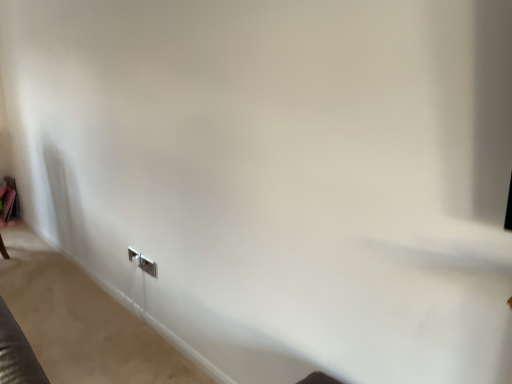
Question: Should I look upward or downward to see white plastic electric outlet at lower left, placed as the second electric outlet when sorted from front to back?

Choices:
 (A) up
 (B) down

Answer: (B)

Question: From a real-world perspective, is white plastic electric outlet at lower center, positioned as the 2th electric outlet in back-to-front order, under white plastic electric outlet at lower left, placed as the second electric outlet when sorted from front to back?

Choices:
 (A) no
 (B) yes

Answer: (A)

Question: From the image's perspective, is white plastic electric outlet at lower center, positioned as the 2th electric outlet in back-to-front order, above white plastic electric outlet at lower left, which appears as the first electric outlet when viewed from the left?

Choices:
 (A) yes
 (B) no

Answer: (B)

Question: Is white plastic electric outlet at lower center, arranged as the 2th electric outlet when viewed from the left, positioned far away from white plastic electric outlet at lower left, placed as the second electric outlet when sorted from front to back?

Choices:
 (A) yes
 (B) no

Answer: (B)

Question: Is white plastic electric outlet at lower center, arranged as the 2th electric outlet when viewed from the left, next to white plastic electric outlet at lower left, acting as the 2th electric outlet starting from the right?

Choices:
 (A) no
 (B) yes

Answer: (A)

Question: Does white plastic electric outlet at lower center, positioned as the 2th electric outlet in back-to-front order, appear on the left side of white plastic electric outlet at lower left, which ranks as the 1th electric outlet in back-to-front order?

Choices:
 (A) no
 (B) yes

Answer: (A)

Question: Is white plastic electric outlet at lower center, the 1th electric outlet viewed from the right, taller than white plastic electric outlet at lower left, acting as the 2th electric outlet starting from the right?

Choices:
 (A) no
 (B) yes

Answer: (B)

Question: Could you tell me if white plastic electric outlet at lower left, acting as the 2th electric outlet starting from the right, is facing white plastic electric outlet at lower center, positioned as the 2th electric outlet in back-to-front order?

Choices:
 (A) no
 (B) yes

Answer: (A)

Question: Is white plastic electric outlet at lower left, which ranks as the 1th electric outlet in back-to-front order, at the left side of white plastic electric outlet at lower center, which ranks as the first electric outlet in front-to-back order?

Choices:
 (A) yes
 (B) no

Answer: (A)

Question: Does white plastic electric outlet at lower left, which appears as the first electric outlet when viewed from the left, have a larger size compared to white plastic electric outlet at lower center, which ranks as the first electric outlet in front-to-back order?

Choices:
 (A) no
 (B) yes

Answer: (B)

Question: Are white plastic electric outlet at lower left, which ranks as the 1th electric outlet in back-to-front order, and white plastic electric outlet at lower center, which ranks as the first electric outlet in front-to-back order, far apart?

Choices:
 (A) yes
 (B) no

Answer: (B)

Question: Does white plastic electric outlet at lower left, which appears as the first electric outlet when viewed from the left, lie in front of white plastic electric outlet at lower center, which ranks as the first electric outlet in front-to-back order?

Choices:
 (A) no
 (B) yes

Answer: (A)

Question: Does white plastic electric outlet at lower left, which ranks as the 1th electric outlet in back-to-front order, have a greater height compared to white plastic electric outlet at lower center, which ranks as the first electric outlet in front-to-back order?

Choices:
 (A) yes
 (B) no

Answer: (B)

Question: Based on their positions, is white plastic electric outlet at lower center, arranged as the 2th electric outlet when viewed from the left, located to the left or right of white plastic electric outlet at lower left, acting as the 2th electric outlet starting from the right?

Choices:
 (A) left
 (B) right

Answer: (B)